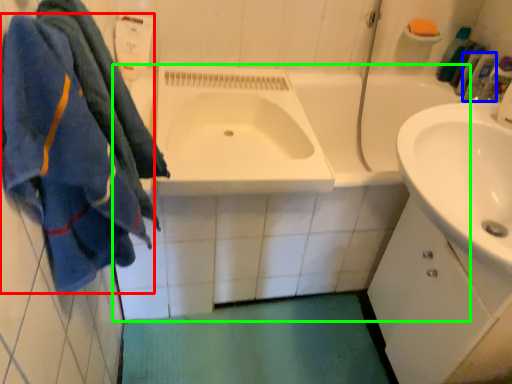
Question: Which is nearer to the bath towel (highlighted by a red box)? toiletry (highlighted by a blue box) or bath (highlighted by a green box).

Choices:
 (A) toiletry
 (B) bath

Answer: (B)